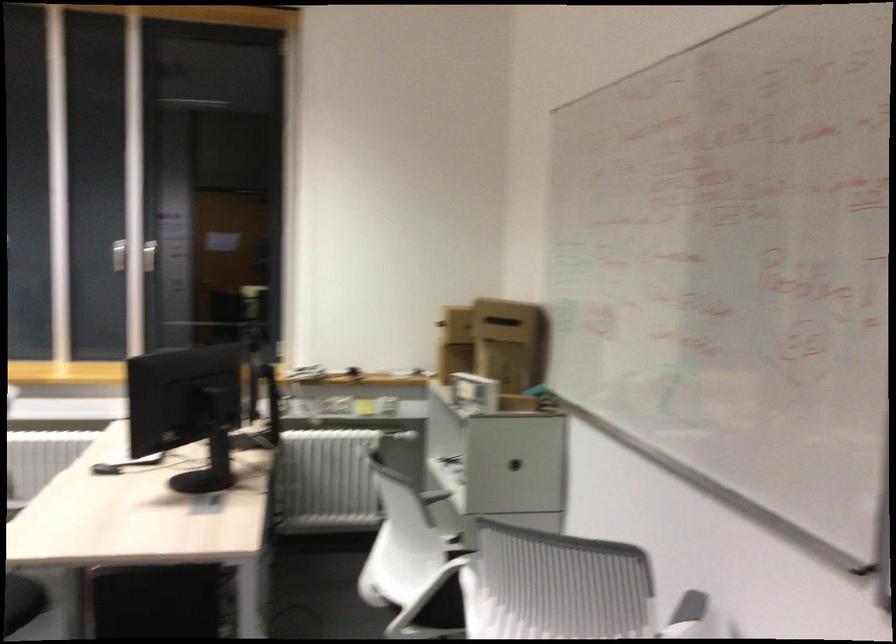
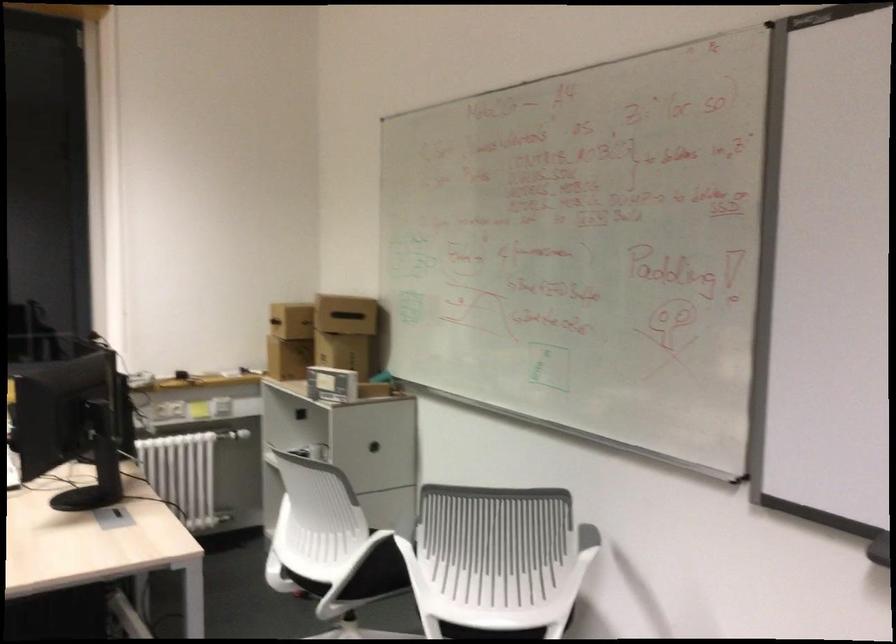
Question: The images are taken continuously from a first-person perspective. In which direction is your viewpoint rotating?

Choices:
 (A) Left
 (B) Right
 (C) Up
 (D) Down

Answer: (B)